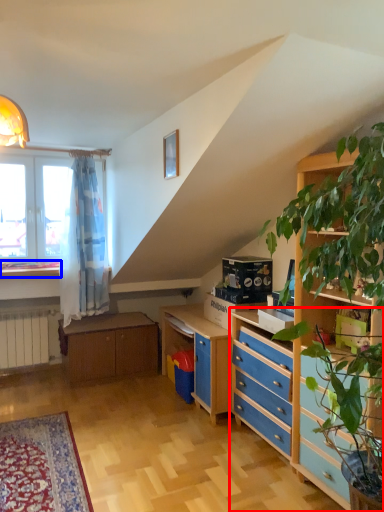
Question: Which point is further to the camera, chest of drawers (highlighted by a red box) or window sill (highlighted by a blue box)?

Choices:
 (A) chest of drawers
 (B) window sill

Answer: (B)